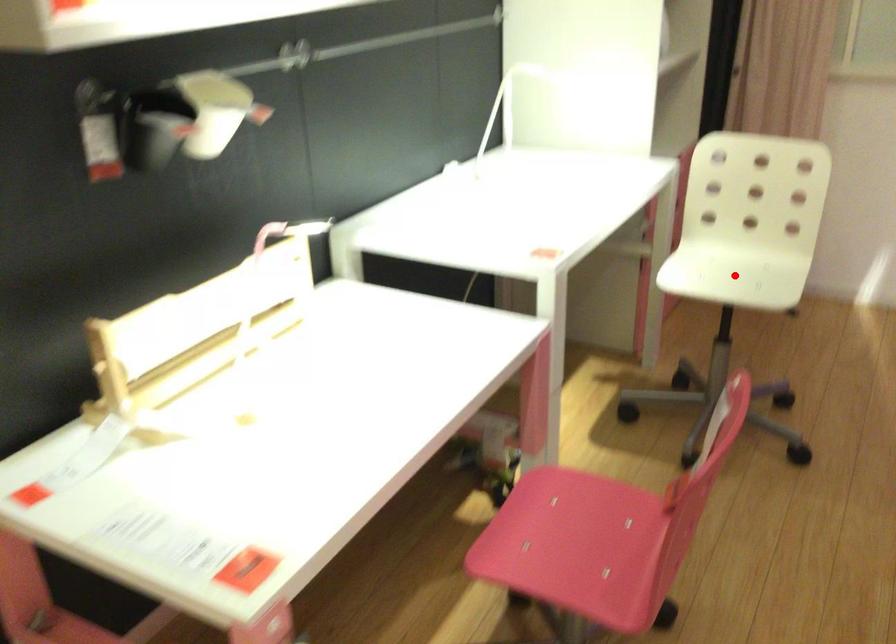
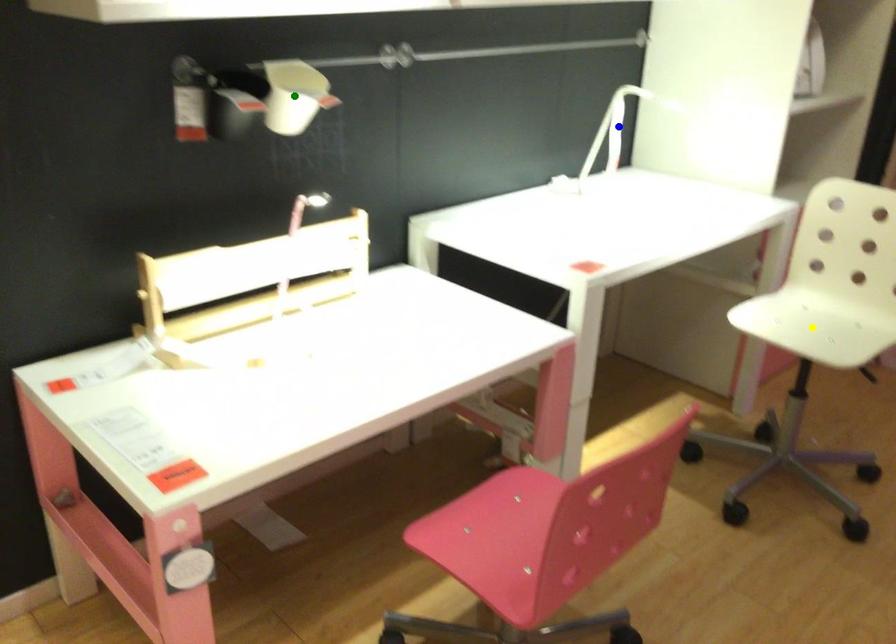
Question: I am providing you with two images of the same scene from different viewpoints. A red point is marked on the first image. You are given multiple points on the second image. Which point in image 2 is actually the same real-world point as the red point in image 1?

Choices:
 (A) green point
 (B) yellow point
 (C) blue point

Answer: (B)